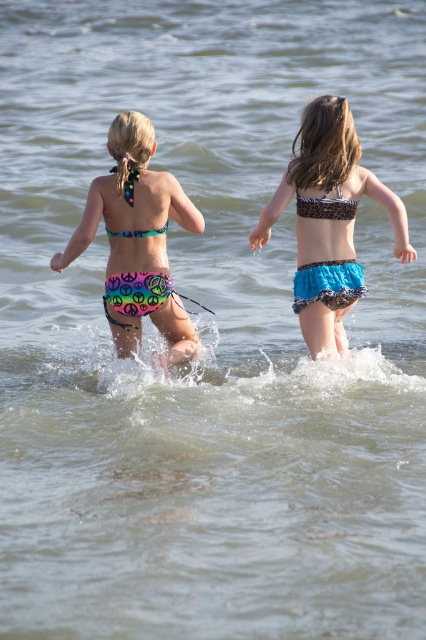
Question: Estimate the real-world distances between objects in this image. Which object is farther from the blue ruffled bikini at center?

Choices:
 (A) rainbow fabric bikini at center
 (B) peace sign print bikini at center

Answer: (B)

Question: Can you confirm if blue ruffled bikini at center is positioned to the right of peace sign print bikini at center?

Choices:
 (A) no
 (B) yes

Answer: (B)

Question: Which object is closer to the camera taking this photo?

Choices:
 (A) blue ruffled bikini at center
 (B) peace sign print bikini at center
 (C) blue textured bikini at center
 (D) rainbow fabric bikini at center

Answer: (D)

Question: Which point is closer to the camera taking this photo?

Choices:
 (A) (117, 234)
 (B) (150, 288)
 (C) (331, 305)

Answer: (B)

Question: Does blue ruffled bikini at center appear on the right side of rainbow fabric bikini at center?

Choices:
 (A) no
 (B) yes

Answer: (B)

Question: Observing the image, what is the correct spatial positioning of blue ruffled bikini at center in reference to rainbow fabric bikini at center?

Choices:
 (A) left
 (B) right

Answer: (B)